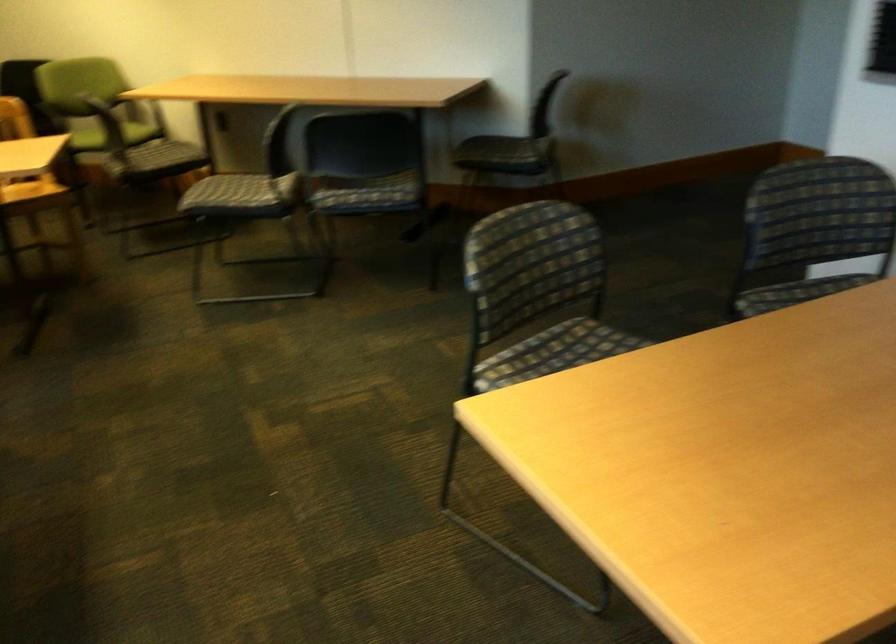
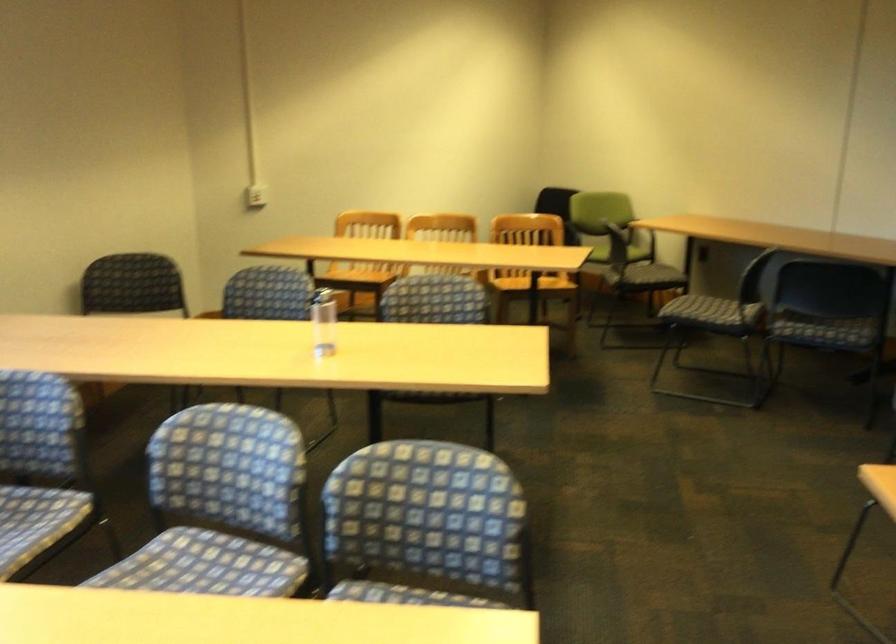
Where in the second image is the point corresponding to point 152,174 from the first image?

(643, 277)